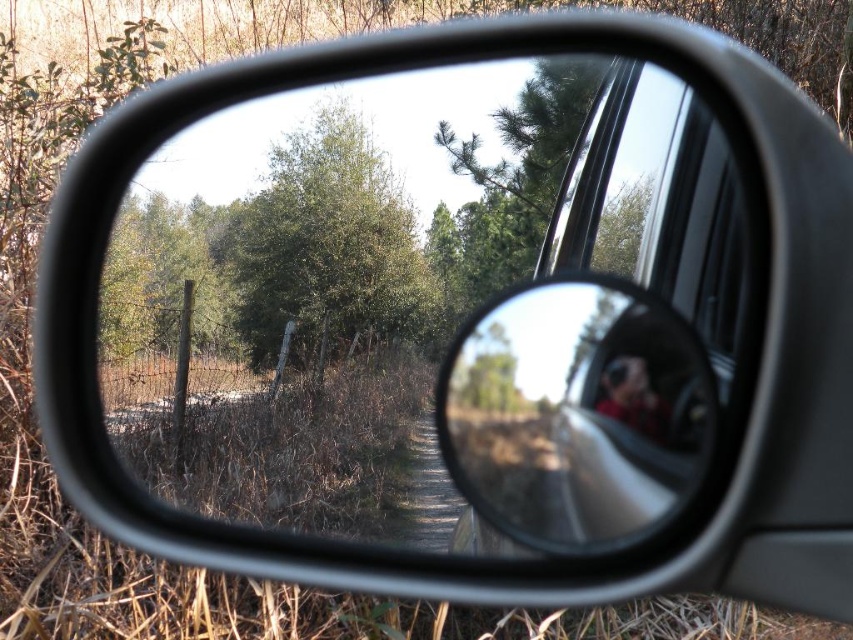
Does glossy metallic mirror at center have a lesser height compared to blurred fabric person at center?

Incorrect, glossy metallic mirror at center's height does not fall short of blurred fabric person at center's.

What do you see at coordinates (575, 412) in the screenshot? I see `glossy metallic mirror at center` at bounding box center [575, 412].

Which is in front, point (630, 340) or point (648, 408)?

Positioned in front is point (648, 408).

Locate an element on the screen. The image size is (853, 640). glossy metallic mirror at center is located at coordinates (575, 412).

Is point (302, 342) behind point (641, 362)?

Yes, it is behind point (641, 362).

Describe the element at coordinates (326, 244) in the screenshot. Image resolution: width=853 pixels, height=640 pixels. I see `green leafy tree at center` at that location.

Identify the location of green leafy tree at center. click(326, 244).

Who is positioned more to the left, glossy metallic mirror at center or green leafy tree at center?

green leafy tree at center is more to the left.

Which is in front, point (585, 326) or point (256, 195)?

Positioned in front is point (585, 326).

The height and width of the screenshot is (640, 853). What do you see at coordinates (575, 412) in the screenshot?
I see `glossy metallic mirror at center` at bounding box center [575, 412].

I want to click on glossy metallic mirror at center, so click(x=575, y=412).